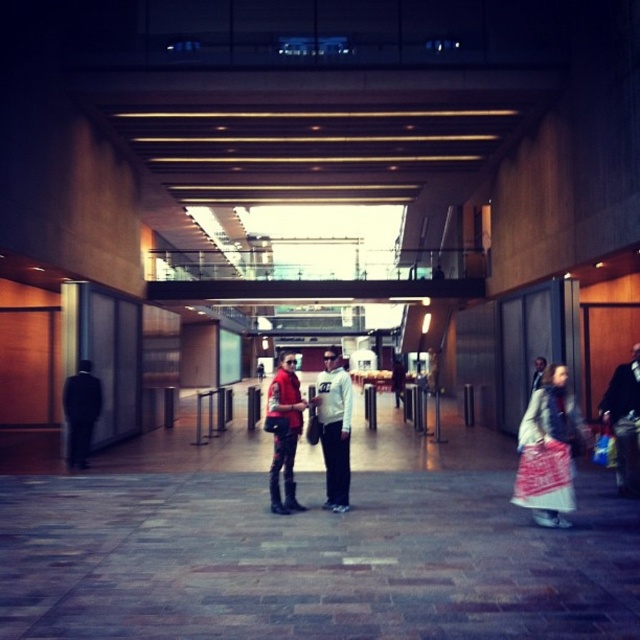
You are standing in the corridor and want to move from point [628,442] to point [67,396]. Which direction should you move to get closer to your destination?

You should move downward and to the left because point [67,396] is further away from the viewer compared to point [628,442], meaning it is located lower and to the left in the corridor.